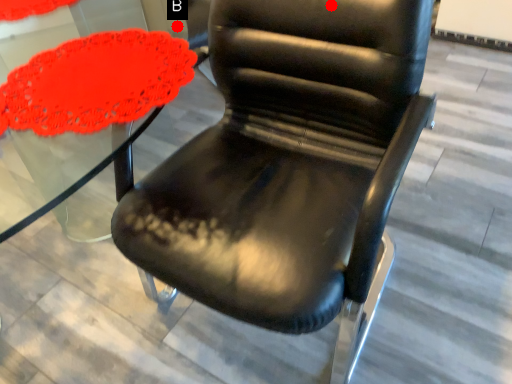
Question: Two points are circled on the image, labeled by A and B beside each circle. Which point appears closest to the camera in this image?

Choices:
 (A) A is closer
 (B) B is closer

Answer: (A)